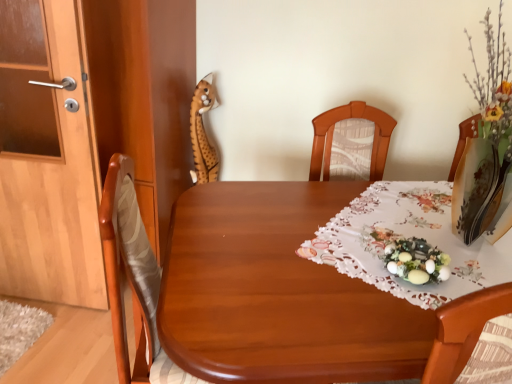
The image size is (512, 384). Describe the element at coordinates (47, 158) in the screenshot. I see `wooden door at left` at that location.

What is the approximate width of wooden table at center?

It is 85.85 centimeters.

What do you see at coordinates (405, 237) in the screenshot? I see `white lace tablecloth at center` at bounding box center [405, 237].

Identify the location of wooden door at left. (47, 158).

In the image, there is a pastel floral wreath at center. What are the coordinates of `door below it (from a real-world perspective)` in the screenshot? It's located at [47, 158].

Considering the relative sizes of wooden door at left and pastel floral wreath at center in the image provided, is wooden door at left smaller than pastel floral wreath at center?

Incorrect, wooden door at left is not smaller in size than pastel floral wreath at center.

From a real-world perspective, which object rests below the other?

In real-world perspective, wooden door at left is lower.

Is wooden door at left positioned far away from pastel floral wreath at center?

Yes, wooden door at left and pastel floral wreath at center are located far from each other.

In terms of width, does spotted plush giraffe at upper left look wider or thinner when compared to wooden table at center?

Clearly, spotted plush giraffe at upper left has less width compared to wooden table at center.

Would you say wooden table at center is part of spotted plush giraffe at upper left's contents?

No, wooden table at center is not surrounded by spotted plush giraffe at upper left.

Are spotted plush giraffe at upper left and wooden table at center making contact?

No, spotted plush giraffe at upper left is not with wooden table at center.

Is spotted plush giraffe at upper left taller or shorter than wooden table at center?

Considering their sizes, spotted plush giraffe at upper left has more height than wooden table at center.

Which is more to the left, white lace tablecloth at center or pastel floral wreath at center?

From the viewer's perspective, pastel floral wreath at center appears more on the left side.

How far apart are white lace tablecloth at center and pastel floral wreath at center?

A distance of 4.99 inches exists between white lace tablecloth at center and pastel floral wreath at center.

Considering the sizes of white lace tablecloth at center and pastel floral wreath at center in the image, is white lace tablecloth at center taller or shorter than pastel floral wreath at center?

In the image, white lace tablecloth at center appears to be taller than pastel floral wreath at center.

Based on the photo, is white lace tablecloth at center far from pastel floral wreath at center?

No, white lace tablecloth at center is not far from pastel floral wreath at center.

Where is `animal above the white lace tablecloth at center (from the image's perspective)`? The width and height of the screenshot is (512, 384). animal above the white lace tablecloth at center (from the image's perspective) is located at coordinates (203, 133).

Between point (452, 291) and point (209, 171), which one is positioned in front?

Positioned in front is point (452, 291).

From the image's perspective, between white lace tablecloth at center and spotted plush giraffe at upper left, which one is located above?

spotted plush giraffe at upper left is shown above in the image.

Is white lace tablecloth at center looking in the opposite direction of wooden door at left?

No, white lace tablecloth at center is not facing away from wooden door at left.

Is white lace tablecloth at center surrounding wooden door at left?

No, wooden door at left is not a part of white lace tablecloth at center.

Looking at their sizes, would you say white lace tablecloth at center is wider or thinner than wooden door at left?

white lace tablecloth at center is wider than wooden door at left.

Considering the sizes of spotted plush giraffe at upper left and wooden door at left in the image, is spotted plush giraffe at upper left taller or shorter than wooden door at left?

Clearly, spotted plush giraffe at upper left is shorter compared to wooden door at left.

From the image's perspective, is spotted plush giraffe at upper left located above or below wooden door at left?

From the image's perspective, spotted plush giraffe at upper left appears above wooden door at left.

Is spotted plush giraffe at upper left in front of or behind wooden door at left in the image?

In the image, spotted plush giraffe at upper left appears behind wooden door at left.

Is spotted plush giraffe at upper left to the right of wooden door at left from the viewer's perspective?

Indeed, spotted plush giraffe at upper left is positioned on the right side of wooden door at left.

Is wooden table at center in front of pastel floral wreath at center?

Yes, it is in front of pastel floral wreath at center.

Consider the image. Considering the relative positions of wooden table at center and pastel floral wreath at center in the image provided, is wooden table at center to the left of pastel floral wreath at center from the viewer's perspective?

Incorrect, wooden table at center is not on the left side of pastel floral wreath at center.

From a real-world perspective, who is located higher, wooden table at center or pastel floral wreath at center?

From a 3D spatial view, pastel floral wreath at center is above.

Locate an element on the screen. This screenshot has height=384, width=512. floral arrangement located on the right of wooden door at left is located at coordinates (412, 258).

Locate an element on the screen. The height and width of the screenshot is (384, 512). table below the spotted plush giraffe at upper left (from a real-world perspective) is located at coordinates (314, 285).

When comparing their distances from pastel floral wreath at center, does spotted plush giraffe at upper left or white lace tablecloth at center seem closer?

white lace tablecloth at center is closer to pastel floral wreath at center.

From the image, which object appears to be farther from wooden table at center, white lace tablecloth at center or wooden door at left?

Based on the image, wooden door at left appears to be further to wooden table at center.

Estimate the real-world distances between objects in this image. Which object is closer to white lace tablecloth at center, wooden table at center or wooden door at left?

wooden table at center.

Looking at the image, which one is located further to wooden table at center, spotted plush giraffe at upper left or pastel floral wreath at center?

spotted plush giraffe at upper left.

Which object lies nearer to the anchor point wooden table at center, wooden door at left or pastel floral wreath at center?

Based on the image, pastel floral wreath at center appears to be nearer to wooden table at center.

Estimate the real-world distances between objects in this image. Which object is further from white lace tablecloth at center, wooden table at center or pastel floral wreath at center?

Based on the image, pastel floral wreath at center appears to be further to white lace tablecloth at center.

Looking at the image, which one is located closer to wooden door at left, pastel floral wreath at center or white lace tablecloth at center?

white lace tablecloth at center is positioned closer to the anchor wooden door at left.

Based on their spatial positions, is wooden door at left or spotted plush giraffe at upper left further from white lace tablecloth at center?

spotted plush giraffe at upper left lies further to white lace tablecloth at center than the other object.

Where is `animal situated between wooden door at left and pastel floral wreath at center from left to right`? The height and width of the screenshot is (384, 512). animal situated between wooden door at left and pastel floral wreath at center from left to right is located at coordinates (203, 133).

Where is `animal between wooden door at left and white lace tablecloth at center from left to right`? The height and width of the screenshot is (384, 512). animal between wooden door at left and white lace tablecloth at center from left to right is located at coordinates (203, 133).

The image size is (512, 384). In order to click on floral arrangement located between white lace tablecloth at center and spotted plush giraffe at upper left in the depth direction in this screenshot , I will do `click(412, 258)`.

Where is `tablecloth between wooden door at left and wooden table at center`? This screenshot has width=512, height=384. tablecloth between wooden door at left and wooden table at center is located at coordinates (405, 237).